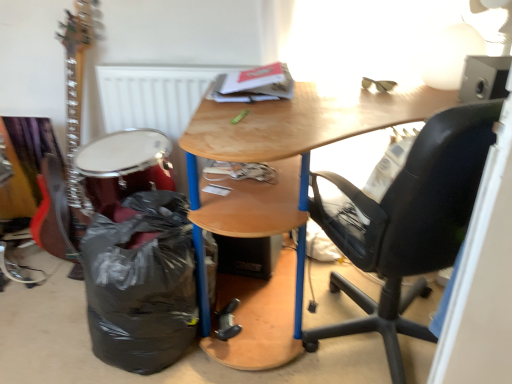
Question: In terms of width, does black plastic bag at lower left look wider or thinner when compared to shiny red drum at lower left?

Choices:
 (A) wide
 (B) thin

Answer: (A)

Question: Considering their positions, is black plastic bag at lower left located in front of or behind shiny red drum at lower left?

Choices:
 (A) behind
 (B) front

Answer: (B)

Question: Based on their relative distances, which object is farther from the black plastic bag at lower left?

Choices:
 (A) shiny red drum at lower left
 (B) white matte radiator at upper center
 (C) black leather office chair at right
 (D) wooden desk at center

Answer: (C)

Question: Based on their relative distances, which object is farther from the black leather office chair at right?

Choices:
 (A) black plastic bag at lower left
 (B) shiny red drum at lower left
 (C) wooden desk at center
 (D) white matte radiator at upper center

Answer: (D)